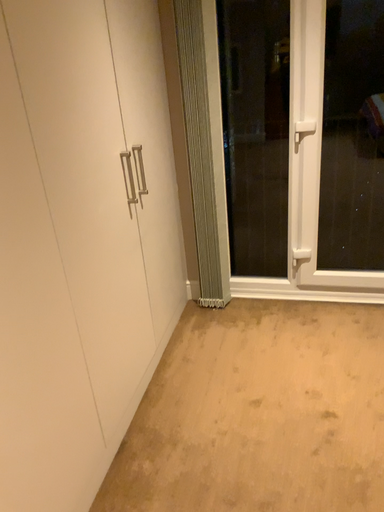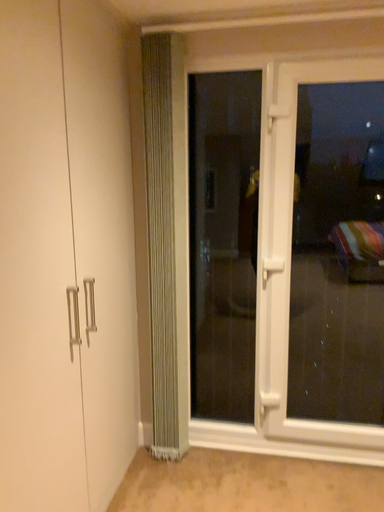
Question: Which way did the camera rotate in the video?

Choices:
 (A) rotated upward
 (B) rotated downward

Answer: (A)